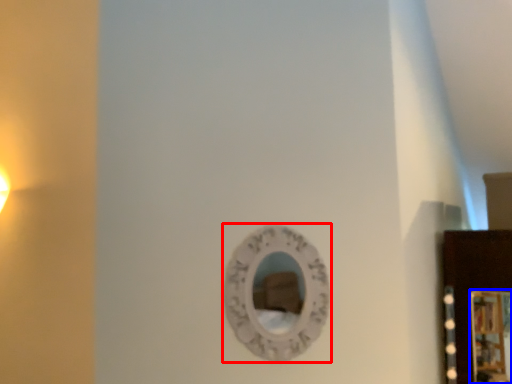
Question: Which object is closer to the camera taking this photo, mirror (highlighted by a red box) or picture frame (highlighted by a blue box)?

Choices:
 (A) mirror
 (B) picture frame

Answer: (A)